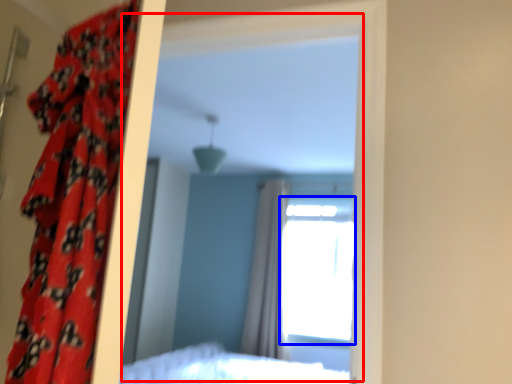
Question: Which object appears closest to the camera in this image, mirror (highlighted by a red box) or window (highlighted by a blue box)?

Choices:
 (A) mirror
 (B) window

Answer: (A)